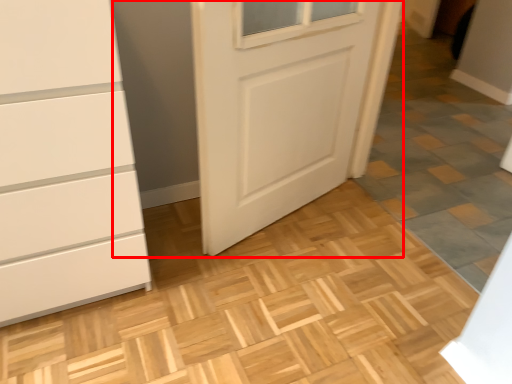
Question: From the image, what is the correct spatial relationship of door (annotated by the red box) in relation to tile?

Choices:
 (A) left
 (B) right

Answer: (A)